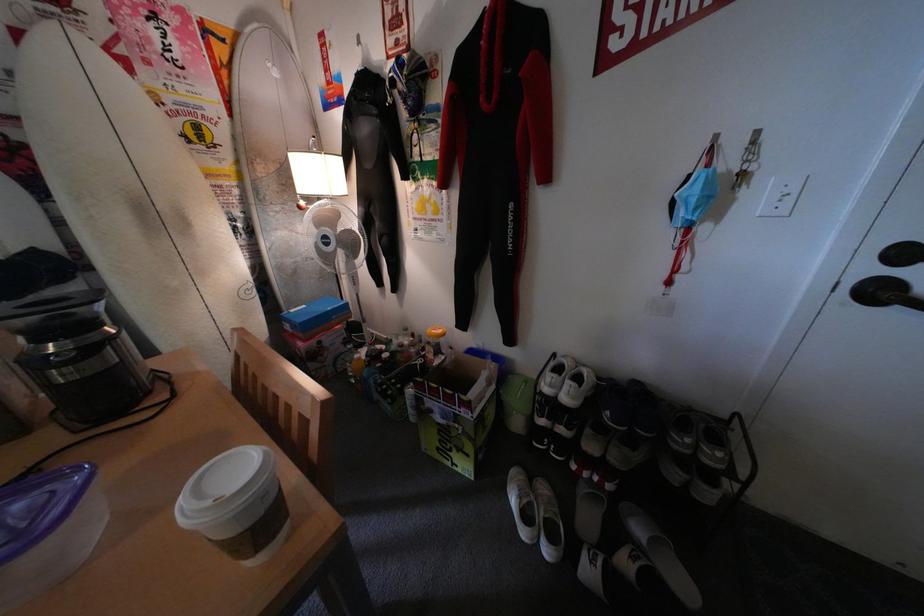
Locate an element on the screen. The image size is (924, 616). orange-capped bottle is located at coordinates (436, 341).